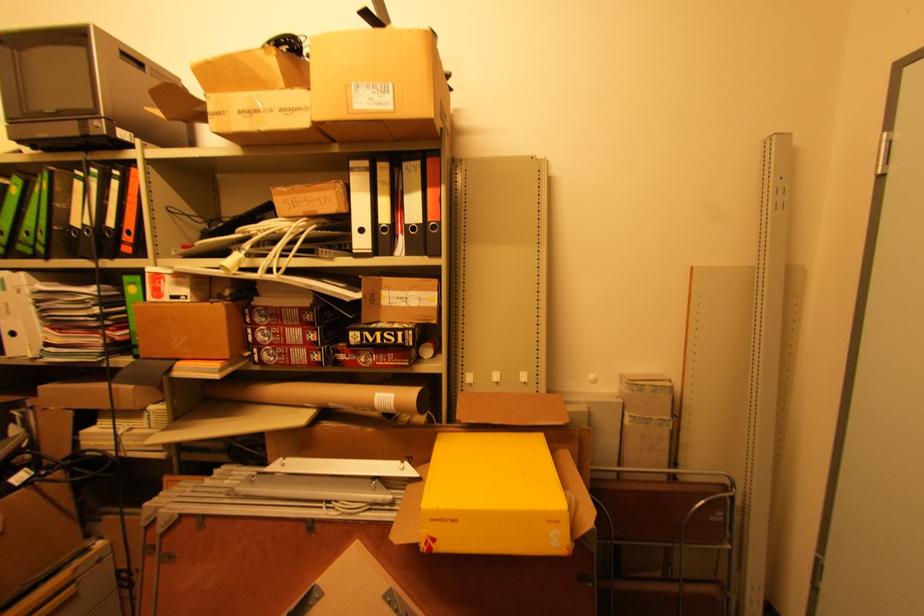
This screenshot has width=924, height=616. What are the coordinates of `orange binder finger hole` in the screenshot? It's located at (130, 233).